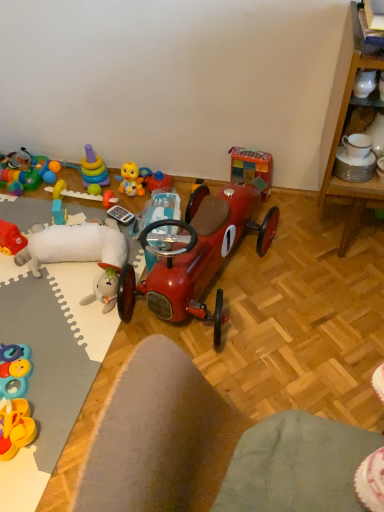
You are a GUI agent. You are given a task and a screenshot of the screen. Output one action in this format:
    pyautogui.click(x=<x>, y=<y>)
    Task: Click on the vacant space positioned to the left of rubberized plastic toy at center, which is the 6th toy in right-to-left order
    Image resolution: width=384 pixels, height=512 pixels.
    Given the screenshot: What is the action you would take?
    pyautogui.click(x=39, y=207)